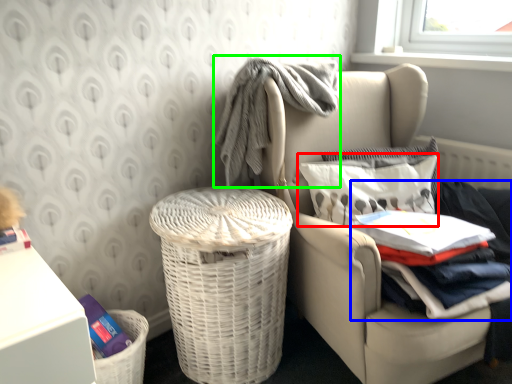
Question: Based on their relative distances, which object is farther from pillow (highlighted by a red box)? Choose from clothing (highlighted by a blue box) and baby clothe (highlighted by a green box).

Choices:
 (A) clothing
 (B) baby clothe

Answer: (B)